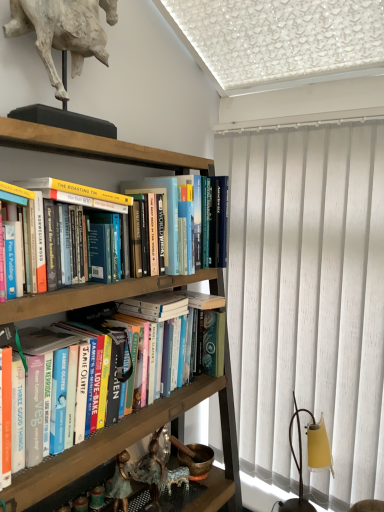
The image size is (384, 512). What do you see at coordinates (108, 442) in the screenshot?
I see `hardcover books at center, which is the second book in top-to-bottom order` at bounding box center [108, 442].

The height and width of the screenshot is (512, 384). What are the coordinates of `hardcover books at center, which is the first book from top to bottom` in the screenshot? It's located at (218, 222).

Describe the element at coordinates (218, 222) in the screenshot. I see `hardcover books at center, which ranks as the 2th book in bottom-to-top order` at that location.

At what (x,y) coordinates should I click in order to perform the action: click on white plaster horse at upper left. Please return your answer as a coordinate pair (x, y). The width and height of the screenshot is (384, 512). Looking at the image, I should click on (x=63, y=32).

Where is `white vertical blinds at right`? The image size is (384, 512). white vertical blinds at right is located at coordinates (308, 301).

Choose the correct answer: Is hardcover books at center, which is the first book from top to bottom, inside white plaster horse at upper left or outside it?

hardcover books at center, which is the first book from top to bottom, is outside white plaster horse at upper left.

Considering the positions of objects hardcover books at center, which is the first book from top to bottom, and white plaster horse at upper left in the image provided, who is more to the right, hardcover books at center, which is the first book from top to bottom, or white plaster horse at upper left?

Positioned to the right is hardcover books at center, which is the first book from top to bottom.

Is hardcover books at center, which is the first book from top to bottom, next to white plaster horse at upper left and touching it?

hardcover books at center, which is the first book from top to bottom, is not next to white plaster horse at upper left, and they're not touching.

Can you confirm if hardcover books at center, which is the first book from top to bottom, is shorter than white plaster horse at upper left?

Correct, hardcover books at center, which is the first book from top to bottom, is not as tall as white plaster horse at upper left.

Can you confirm if hardcover books at center, which ranks as the 2th book in bottom-to-top order, is bigger than white vertical blinds at right?

Incorrect, hardcover books at center, which ranks as the 2th book in bottom-to-top order, is not larger than white vertical blinds at right.

You are a GUI agent. You are given a task and a screenshot of the screen. Output one action in this format:
    pyautogui.click(x=<x>, y=<y>)
    Task: Click on the curtain on the right of hardcover books at center, which ranks as the 2th book in bottom-to-top order
    Image resolution: width=384 pixels, height=512 pixels.
    Given the screenshot: What is the action you would take?
    pyautogui.click(x=308, y=301)

From the picture: Can you confirm if hardcover books at center, which is the first book from top to bottom, is positioned to the right of white vertical blinds at right?

In fact, hardcover books at center, which is the first book from top to bottom, is to the left of white vertical blinds at right.

How distant is hardcover books at center, which ranks as the 2th book in bottom-to-top order, from white vertical blinds at right?

The distance of hardcover books at center, which ranks as the 2th book in bottom-to-top order, from white vertical blinds at right is 16.36 inches.

Is white vertical blinds at right in contact with hardcover books at center, which appears as the 1th book when ordered from the bottom?

No.

Does point (244, 142) come behind point (23, 472)?

That is True.

Is white vertical blinds at right turned away from hardcover books at center, which is the second book in top-to-bottom order?

white vertical blinds at right does not have its back to hardcover books at center, which is the second book in top-to-bottom order.

Based on their positions, is white vertical blinds at right located to the left or right of hardcover books at center, which appears as the 1th book when ordered from the bottom?

Clearly, white vertical blinds at right is on the right of hardcover books at center, which appears as the 1th book when ordered from the bottom, in the image.

Is hardcover books at center, which appears as the 1th book when ordered from the bottom, surrounding wooden bookshelf at upper left?

No, wooden bookshelf at upper left is not a part of hardcover books at center, which appears as the 1th book when ordered from the bottom.

Based on the photo, from a real-world perspective, is hardcover books at center, which is the second book in top-to-bottom order, physically located above or below wooden bookshelf at upper left?

From a real-world perspective, hardcover books at center, which is the second book in top-to-bottom order, is physically above wooden bookshelf at upper left.

Can you confirm if hardcover books at center, which appears as the 1th book when ordered from the bottom, is bigger than wooden bookshelf at upper left?

No, hardcover books at center, which appears as the 1th book when ordered from the bottom, is not bigger than wooden bookshelf at upper left.

Does point (212, 383) come farther from viewer compared to point (50, 306)?

Yes, point (212, 383) is behind point (50, 306).

In the image, is white plaster horse at upper left positioned in front of or behind white vertical blinds at right?

white plaster horse at upper left is in front of white vertical blinds at right.

Considering the relative positions of white plaster horse at upper left and white vertical blinds at right in the image provided, is white plaster horse at upper left to the left or to the right of white vertical blinds at right?

white plaster horse at upper left is positioned on white vertical blinds at right's left side.

The width and height of the screenshot is (384, 512). What are the coordinates of `curtain below the white plaster horse at upper left (from the image's perspective)` in the screenshot? It's located at (308, 301).

What's the angular difference between white plaster horse at upper left and white vertical blinds at right's facing directions?

The angular difference between white plaster horse at upper left and white vertical blinds at right is 91.9 degrees.

Considering the sizes of white vertical blinds at right and hardcover books at center, which ranks as the 2th book in bottom-to-top order, in the image, is white vertical blinds at right taller or shorter than hardcover books at center, which ranks as the 2th book in bottom-to-top order,?

white vertical blinds at right is taller than hardcover books at center, which ranks as the 2th book in bottom-to-top order.

Is white vertical blinds at right situated inside hardcover books at center, which is the first book from top to bottom, or outside?

white vertical blinds at right is not enclosed by hardcover books at center, which is the first book from top to bottom.

Locate an element on the screen. The height and width of the screenshot is (512, 384). curtain that appears behind the hardcover books at center, which ranks as the 2th book in bottom-to-top order is located at coordinates (308, 301).

Which object is closer to the camera taking this photo, white vertical blinds at right or hardcover books at center, which ranks as the 2th book in bottom-to-top order?

hardcover books at center, which ranks as the 2th book in bottom-to-top order, is closer to the camera.

Does hardcover books at center, which is the second book in top-to-bottom order, lie behind hardcover books at center, which ranks as the 2th book in bottom-to-top order?

No, it is not.

Is hardcover books at center, which appears as the 1th book when ordered from the bottom, aimed at hardcover books at center, which ranks as the 2th book in bottom-to-top order?

No, hardcover books at center, which appears as the 1th book when ordered from the bottom, is not turned towards hardcover books at center, which ranks as the 2th book in bottom-to-top order.

From the image's perspective, between hardcover books at center, which is the second book in top-to-bottom order, and hardcover books at center, which ranks as the 2th book in bottom-to-top order, which one is located above?

hardcover books at center, which ranks as the 2th book in bottom-to-top order, from the image's perspective.

How many degrees apart are the facing directions of hardcover books at center, which appears as the 1th book when ordered from the bottom, and hardcover books at center, which ranks as the 2th book in bottom-to-top order?

2.09 degrees separate the facing orientations of hardcover books at center, which appears as the 1th book when ordered from the bottom, and hardcover books at center, which ranks as the 2th book in bottom-to-top order.

Locate an element on the screen. This screenshot has height=512, width=384. animal that is above the hardcover books at center, which is the first book from top to bottom (from a real-world perspective) is located at coordinates (63, 32).

The width and height of the screenshot is (384, 512). In order to click on the 1st book to the left of the white vertical blinds at right, counting from the anchor's position in this screenshot , I will do `click(218, 222)`.

Which object lies further to the anchor point hardcover books at center, which ranks as the 2th book in bottom-to-top order, hardcover books at center, which appears as the 1th book when ordered from the bottom, or white vertical blinds at right?

The object further to hardcover books at center, which ranks as the 2th book in bottom-to-top order, is hardcover books at center, which appears as the 1th book when ordered from the bottom.

Considering their positions, is wooden bookshelf at upper left positioned further to hardcover books at center, which appears as the 1th book when ordered from the bottom, than hardcover books at center, which ranks as the 2th book in bottom-to-top order?

Based on the image, wooden bookshelf at upper left appears to be further to hardcover books at center, which appears as the 1th book when ordered from the bottom.

Which object lies further to the anchor point hardcover books at center, which is the second book in top-to-bottom order, hardcover books at center, which is the first book from top to bottom, or white vertical blinds at right?

Based on the image, white vertical blinds at right appears to be further to hardcover books at center, which is the second book in top-to-bottom order.

Which object lies nearer to the anchor point hardcover books at center, which ranks as the 2th book in bottom-to-top order, white plaster horse at upper left or hardcover books at center, which is the second book in top-to-bottom order?

The object closer to hardcover books at center, which ranks as the 2th book in bottom-to-top order, is white plaster horse at upper left.

Consider the image. Based on their spatial positions, is hardcover books at center, which appears as the 1th book when ordered from the bottom, or white plaster horse at upper left closer to white vertical blinds at right?

hardcover books at center, which appears as the 1th book when ordered from the bottom, lies closer to white vertical blinds at right than the other object.

From the image, which object appears to be farther from white plaster horse at upper left, white vertical blinds at right or wooden bookshelf at upper left?

The object further to white plaster horse at upper left is white vertical blinds at right.

Which object lies nearer to the anchor point hardcover books at center, which is the second book in top-to-bottom order, wooden bookshelf at upper left or white vertical blinds at right?

white vertical blinds at right lies closer to hardcover books at center, which is the second book in top-to-bottom order, than the other object.

Based on the photo, when comparing their distances from hardcover books at center, which appears as the 1th book when ordered from the bottom, does hardcover books at center, which ranks as the 2th book in bottom-to-top order, or white plaster horse at upper left seem further?

The object further to hardcover books at center, which appears as the 1th book when ordered from the bottom, is white plaster horse at upper left.

Identify the location of book between wooden bookshelf at upper left and hardcover books at center, which ranks as the 2th book in bottom-to-top order, from front to back. The image size is (384, 512). (108, 442).

The width and height of the screenshot is (384, 512). I want to click on book between white plaster horse at upper left and white vertical blinds at right in the up-down direction, so pyautogui.click(x=218, y=222).

Image resolution: width=384 pixels, height=512 pixels. I want to click on book between hardcover books at center, which is the second book in top-to-bottom order, and white vertical blinds at right, in the horizontal direction, so click(218, 222).

At what (x,y) coordinates should I click in order to perform the action: click on book between white plaster horse at upper left and hardcover books at center, which appears as the 1th book when ordered from the bottom, in the up-down direction. Please return your answer as a coordinate pair (x, y). The width and height of the screenshot is (384, 512). Looking at the image, I should click on (218, 222).